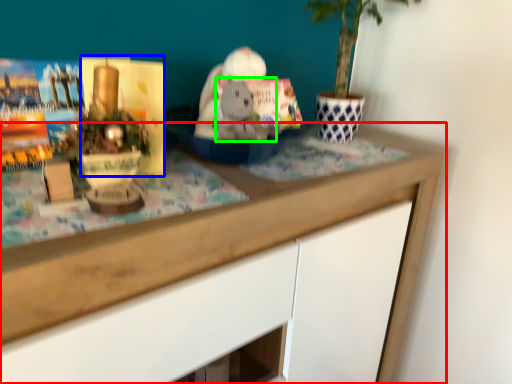
Question: Which is nearer to the desk (highlighted by a red box)? paperback book (highlighted by a blue box) or animal (highlighted by a green box).

Choices:
 (A) paperback book
 (B) animal

Answer: (B)